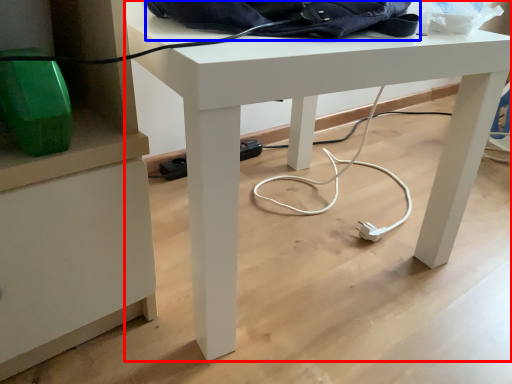
Question: Which point is closer to the camera, desk (highlighted by a red box) or messenger bag (highlighted by a blue box)?

Choices:
 (A) desk
 (B) messenger bag

Answer: (A)